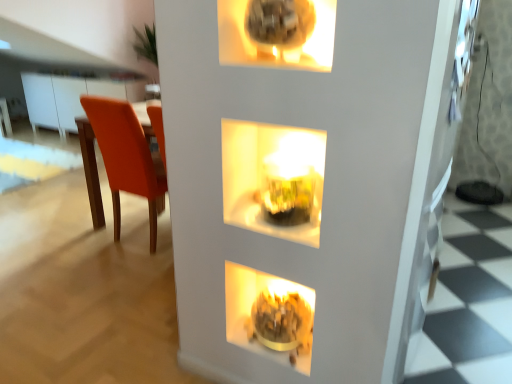
Question: From the image's perspective, is orange matte chair at left on top of translucent glass vase at center?

Choices:
 (A) yes
 (B) no

Answer: (A)

Question: Can you confirm if orange matte chair at left is wider than translucent glass vase at center?

Choices:
 (A) no
 (B) yes

Answer: (B)

Question: Are orange matte chair at left and translucent glass vase at center far apart?

Choices:
 (A) no
 (B) yes

Answer: (B)

Question: Would you say orange matte chair at left is outside translucent glass vase at center?

Choices:
 (A) yes
 (B) no

Answer: (A)

Question: From a real-world perspective, is orange matte chair at left beneath translucent glass vase at center?

Choices:
 (A) no
 (B) yes

Answer: (B)

Question: In terms of size, does translucent glass vase at center appear bigger or smaller than matte gold bowl at lower center?

Choices:
 (A) big
 (B) small

Answer: (A)

Question: Relative to matte gold bowl at lower center, is translucent glass vase at center in front or behind?

Choices:
 (A) behind
 (B) front

Answer: (B)

Question: From a real-world perspective, relative to matte gold bowl at lower center, is translucent glass vase at center vertically above or below?

Choices:
 (A) above
 (B) below

Answer: (A)

Question: Considering the positions of translucent glass vase at center and matte gold bowl at lower center in the image, is translucent glass vase at center taller or shorter than matte gold bowl at lower center?

Choices:
 (A) tall
 (B) short

Answer: (A)

Question: Would you say matte gold bowl at lower center is inside or outside orange matte chair at left?

Choices:
 (A) inside
 (B) outside

Answer: (B)

Question: In terms of size, does matte gold bowl at lower center appear bigger or smaller than orange matte chair at left?

Choices:
 (A) big
 (B) small

Answer: (B)

Question: Is matte gold bowl at lower center wider or thinner than orange matte chair at left?

Choices:
 (A) wide
 (B) thin

Answer: (B)

Question: Considering the positions of matte gold bowl at lower center and orange matte chair at left in the image, is matte gold bowl at lower center taller or shorter than orange matte chair at left?

Choices:
 (A) short
 (B) tall

Answer: (A)

Question: From the image's perspective, relative to translucent glass vase at center, is orange matte chair at left above or below?

Choices:
 (A) above
 (B) below

Answer: (A)

Question: From a real-world perspective, is orange matte chair at left above or below translucent glass vase at center?

Choices:
 (A) above
 (B) below

Answer: (B)